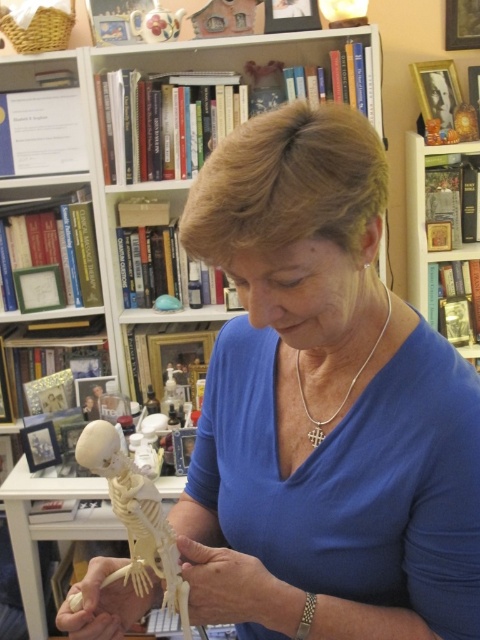
You are a student who needs to choose between the transparent plastic skeleton at lower left and the translucent plastic hand at center for a presentation. Which object is wider?

The transparent plastic skeleton at lower left is wider than the translucent plastic hand at center because its width surpasses that of the translucent plastic hand at center.

You are a photographer standing at a distance of 26.42 inches from the point marked at coordinates point (x=294, y=616). You need to take a photo of the woman holding the skeleton model. Is your current distance sufficient to capture the entire scene in one frame?

The point (x=294, y=616) is 26.42 inches away from the camera. Since the photographer is already at this distance, it should be sufficient to capture the entire scene in one frame.